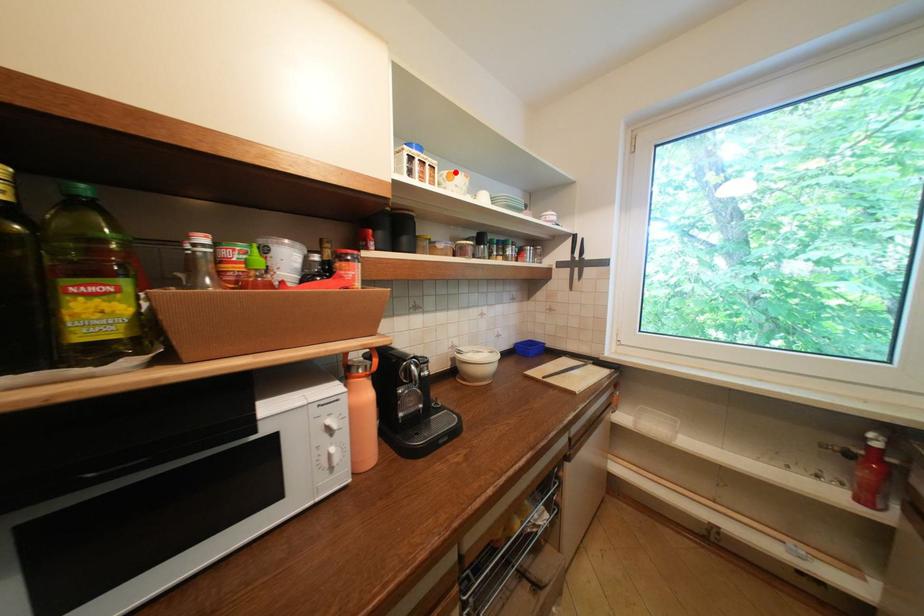
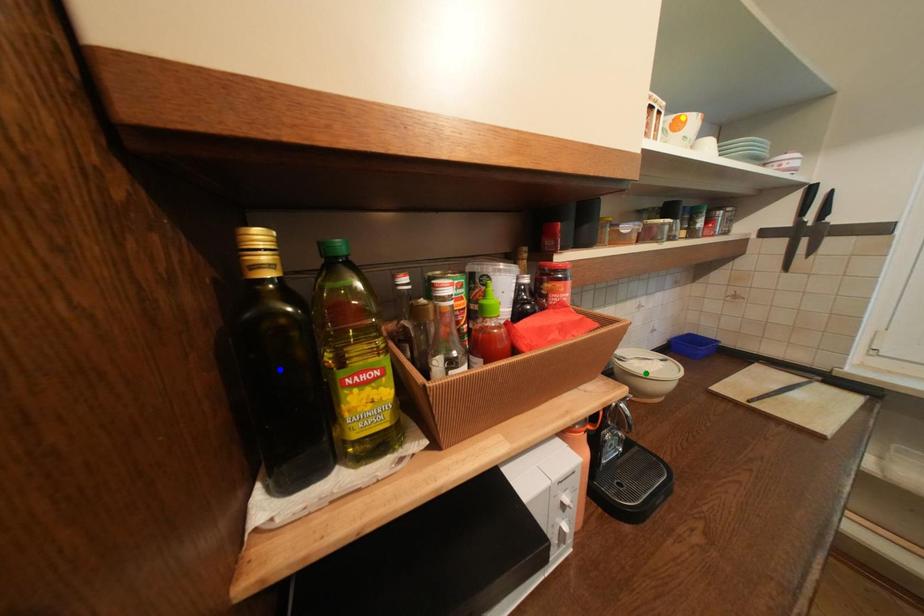
Question: I am providing you with two images of the same scene from different viewpoints. A red point is marked on the first image. You are given multiple points on the second image. Which spot in image 2 lines up with the point in image 1?

Choices:
 (A) blue point
 (B) yellow point
 (C) green point

Answer: (B)